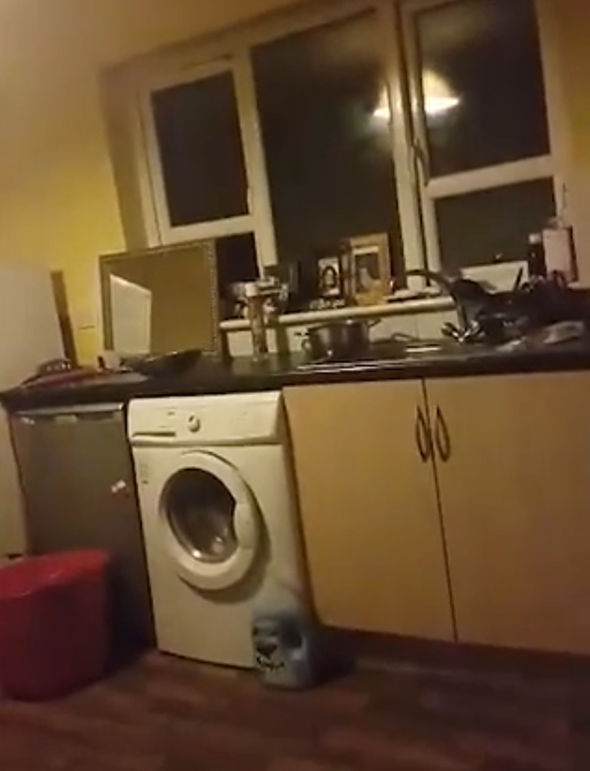
Locate an element on the screen. Image resolution: width=590 pixels, height=771 pixels. cabinet handle is located at coordinates (419, 443), (437, 442).